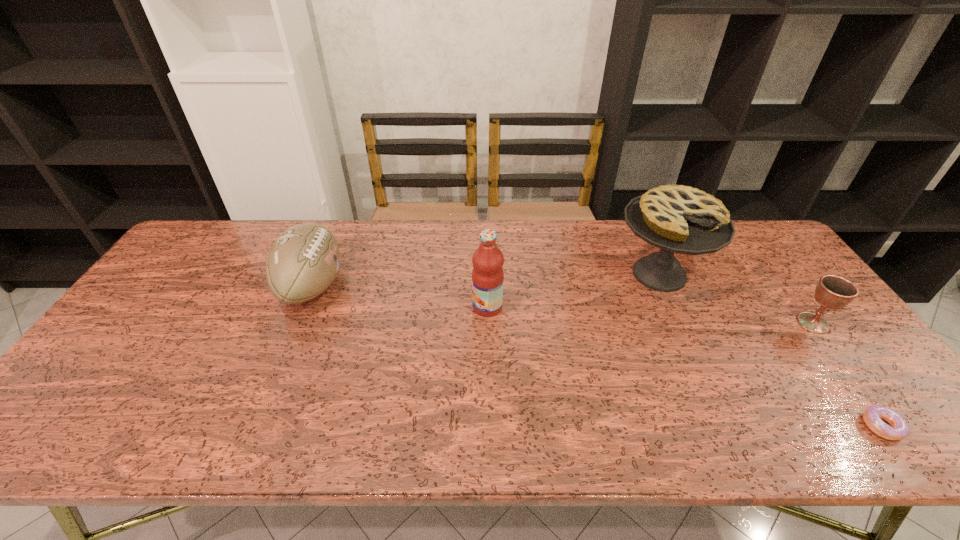
Where is `pie`? pie is located at coordinates (680, 219).

Where is `fruit juice`? The image size is (960, 540). fruit juice is located at coordinates (487, 274).

The height and width of the screenshot is (540, 960). Identify the location of the leftmost object. (303, 261).

Image resolution: width=960 pixels, height=540 pixels. What are the coordinates of `football (American)` in the screenshot? It's located at (303, 261).

Find the location of `chalice`. chalice is located at coordinates (834, 292).

Identify the location of the shortest object. (872, 416).

In order to click on the nearest object in this screenshot , I will do `click(872, 416)`.

In order to click on vacant point located on the cut side of the pie in this screenshot , I will do `click(728, 425)`.

At what (x,y) coordinates should I click in order to perform the action: click on vacant region located on the front label of the fruit juice. Please return your answer as a coordinate pair (x, y). This screenshot has height=540, width=960. Looking at the image, I should click on (346, 307).

The height and width of the screenshot is (540, 960). I want to click on free space located on the front label of the fruit juice, so click(384, 307).